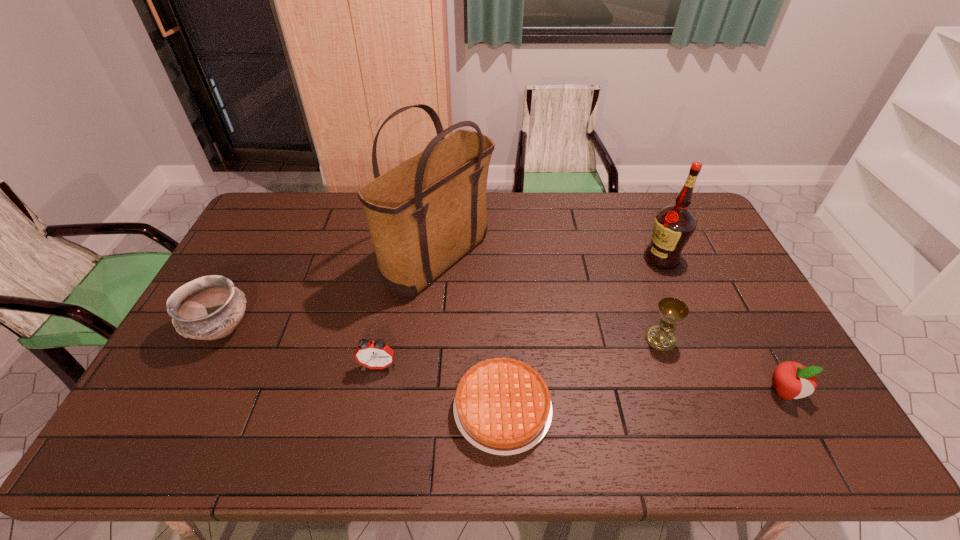
Where is `tote bag`? Image resolution: width=960 pixels, height=540 pixels. tote bag is located at coordinates (423, 215).

Locate an element on the screen. alcohol is located at coordinates (674, 225).

Image resolution: width=960 pixels, height=540 pixels. I want to click on the leftmost object, so click(x=208, y=308).

The image size is (960, 540). I want to click on chalice, so click(x=672, y=310).

Where is `alarm clock`? Image resolution: width=960 pixels, height=540 pixels. alarm clock is located at coordinates (376, 354).

Locate an element on the screen. Image resolution: width=960 pixels, height=540 pixels. the rightmost object is located at coordinates (791, 380).

You are a GUI agent. You are given a task and a screenshot of the screen. Output one action in this format:
    pyautogui.click(x=<x>, y=<y>)
    Task: Click on the shortest object
    Image resolution: width=960 pixels, height=540 pixels.
    Given the screenshot: What is the action you would take?
    pyautogui.click(x=502, y=406)

Locate an element on the screen. The width and height of the screenshot is (960, 540). vacant space located 0.130m on the back of the tallest object is located at coordinates (444, 200).

The image size is (960, 540). In order to click on free space located 0.050m on the label of the alcohol in this screenshot , I will do `click(629, 259)`.

The image size is (960, 540). In order to click on vacant area situated 0.130m on the label of the alcohol in this screenshot , I will do `click(605, 259)`.